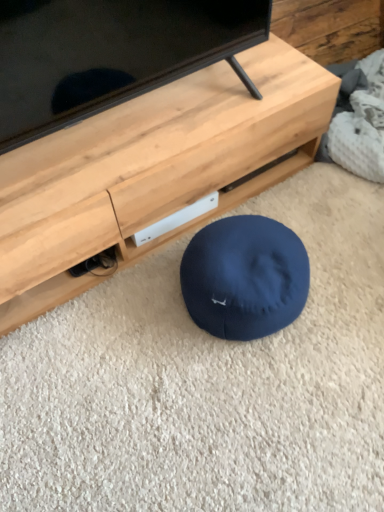
This screenshot has height=512, width=384. Identify the location of matte wood tv stand at center. (151, 169).

Measure the distance between matte wood tv stand at center and camera.

matte wood tv stand at center and camera are 35.29 inches apart.

Describe the element at coordinates (151, 169) in the screenshot. I see `matte wood tv stand at center` at that location.

Identify the location of matte black tv at center. (109, 54).

Describe the element at coordinates (109, 54) in the screenshot. The width and height of the screenshot is (384, 512). I see `matte black tv at center` at that location.

Where is `matte wood tv stand at center`? This screenshot has width=384, height=512. matte wood tv stand at center is located at coordinates (151, 169).

Considering the positions of objects matte black tv at center and matte wood tv stand at center in the image provided, who is more to the left, matte black tv at center or matte wood tv stand at center?

matte black tv at center.

Which object is further away from the camera taking this photo, matte black tv at center or matte wood tv stand at center?

matte wood tv stand at center is behind.

Does point (0, 41) come farther from viewer compared to point (61, 145)?

No, it is in front of (61, 145).

From the image's perspective, who appears lower, matte black tv at center or matte wood tv stand at center?

matte wood tv stand at center.

From a real-world perspective, who is located lower, matte black tv at center or matte wood tv stand at center?

matte wood tv stand at center, from a real-world perspective.

Can you confirm if matte black tv at center is wider than matte wood tv stand at center?

Incorrect, the width of matte black tv at center does not surpass that of matte wood tv stand at center.

In the scene shown: Is matte black tv at center taller or shorter than matte wood tv stand at center?

Clearly, matte black tv at center is taller compared to matte wood tv stand at center.

Is matte black tv at center smaller than matte wood tv stand at center?

Yes.

Is matte black tv at center located outside matte wood tv stand at center?

Yes, matte black tv at center is not within matte wood tv stand at center.

Is matte black tv at center not near matte wood tv stand at center?

Actually, matte black tv at center and matte wood tv stand at center are a little close together.

Is matte black tv at center oriented towards matte wood tv stand at center?

No, matte black tv at center is not oriented towards matte wood tv stand at center.

How many degrees apart are the facing directions of matte black tv at center and matte wood tv stand at center?

They differ by 0.0488 degrees in their facing directions.

Consider the image. Measure the distance between matte black tv at center and matte wood tv stand at center.

matte black tv at center is 7.24 inches from matte wood tv stand at center.

I want to click on television that appears above the matte wood tv stand at center (from a real-world perspective), so click(109, 54).

Between matte wood tv stand at center and matte black tv at center, which one appears on the right side from the viewer's perspective?

matte wood tv stand at center is more to the right.

Considering their positions, is matte wood tv stand at center located in front of or behind matte black tv at center?

matte wood tv stand at center is positioned farther from the viewer than matte black tv at center.

Considering the positions of point (102, 126) and point (119, 3), is point (102, 126) closer or farther from the camera than point (119, 3)?

Point (102, 126) is positioned farther from the camera compared to point (119, 3).

From the image's perspective, between matte wood tv stand at center and matte black tv at center, which one is located above?

matte black tv at center, from the image's perspective.

From a real-world perspective, is matte wood tv stand at center below matte black tv at center?

Yes, from a real-world perspective, matte wood tv stand at center is beneath matte black tv at center.

Can you confirm if matte wood tv stand at center is thinner than matte black tv at center?

Incorrect, the width of matte wood tv stand at center is not less than that of matte black tv at center.

In terms of height, does matte wood tv stand at center look taller or shorter compared to matte black tv at center?

matte wood tv stand at center is shorter than matte black tv at center.

In terms of size, does matte wood tv stand at center appear bigger or smaller than matte black tv at center?

matte wood tv stand at center is bigger than matte black tv at center.

Is matte wood tv stand at center surrounding matte black tv at center?

No.

Is matte wood tv stand at center positioned far away from matte black tv at center?

No, matte wood tv stand at center is not far from matte black tv at center.

Does matte wood tv stand at center turn towards matte black tv at center?

No, matte wood tv stand at center is not turned towards matte black tv at center.

How different are the orientations of matte wood tv stand at center and matte black tv at center in degrees?

matte wood tv stand at center and matte black tv at center are facing 0.0488 degrees away from each other.

This screenshot has height=512, width=384. What are the coordinates of `television above the matte wood tv stand at center (from the image's perspective)` in the screenshot? It's located at (109, 54).

Find the location of a particular element. This screenshot has width=384, height=512. furniture below the matte black tv at center (from the image's perspective) is located at coordinates (151, 169).

The height and width of the screenshot is (512, 384). I want to click on television located on the left of matte wood tv stand at center, so click(x=109, y=54).